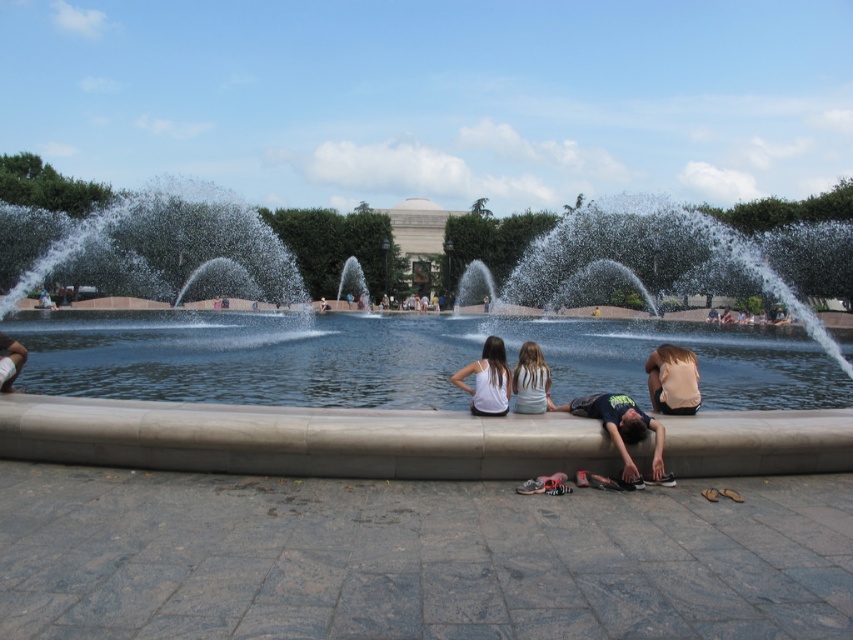
Is point (720, 348) positioned after point (16, 346)?

That is True.

Is clear water at center wider than white cotton shirt at lower left?

Correct, the width of clear water at center exceeds that of white cotton shirt at lower left.

Identify the location of clear water at center. (399, 358).

This screenshot has height=640, width=853. Find the location of `dark blue t-shirt at center`. dark blue t-shirt at center is located at coordinates (619, 428).

Does dark blue t-shirt at center have a lesser height compared to light brown fabric shirt at lower right?

No, dark blue t-shirt at center is not shorter than light brown fabric shirt at lower right.

Is point (567, 410) positioned in front of point (659, 358)?

Yes, point (567, 410) is closer to viewer.

Locate an element on the screen. The image size is (853, 640). dark blue t-shirt at center is located at coordinates (619, 428).

Identify the location of white tank top at center. The width and height of the screenshot is (853, 640). (486, 380).

Does white tank top at center have a smaller size compared to white cotton shirt at lower left?

Actually, white tank top at center might be larger than white cotton shirt at lower left.

Is point (473, 368) less distant than point (4, 349)?

No, (473, 368) is behind (4, 349).

This screenshot has height=640, width=853. Find the location of `white tank top at center`. white tank top at center is located at coordinates (486, 380).